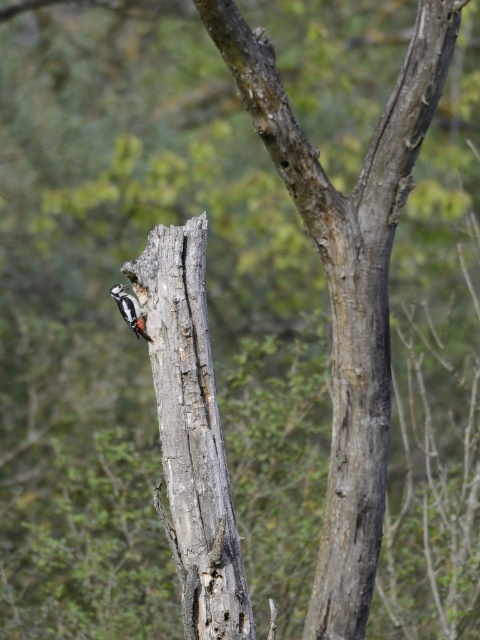
You are standing in the outdoor scene and want to walk from the point at coordinates point (134, 282) to the point at coordinates point (144, 333). Which direction should you move relative to the woodpecker?

Since point (134, 282) is in front of point (144, 333), you should move backward away from the woodpecker to reach point (144, 333).

You are a birdwatcher observing the scene. You notice the gray rough bark tree trunk at center and the speckled brown woodpecker at center. Which object is closer to you?

The gray rough bark tree trunk at center is closer to you because it is positioned in front of the speckled brown woodpecker at center.

You are a birdwatcher trying to locate the gray rough bark tree trunk at center. Based on the coordinates provided, in which quadrant of the image would you find the tree trunk?

The gray rough bark tree trunk at center is located at coordinates approximately 0.678 on the x and 0.4 on the y axis. Since the center of the image is at 0.5 on both axes, a coordinate higher than 0.5 on the x axis places it to the right of center, and lower than 0.5 on the y axis places it below center. Therefore, the tree trunk is in the lower right quadrant of the image.